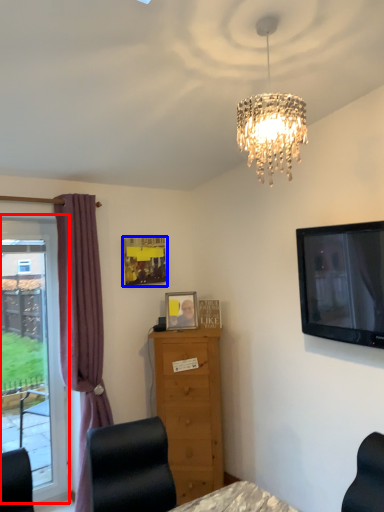
Question: Which of the following is the closest to the observer, window (highlighted by a red box) or picture frame (highlighted by a blue box)?

Choices:
 (A) window
 (B) picture frame

Answer: (A)